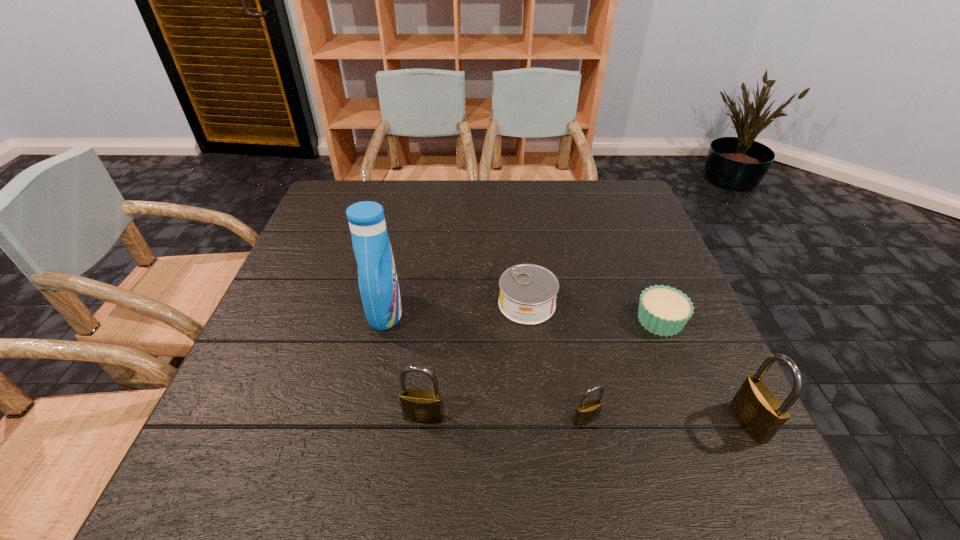
The height and width of the screenshot is (540, 960). Find the location of `the second shortest padlock`. the second shortest padlock is located at coordinates (423, 406).

The height and width of the screenshot is (540, 960). In order to click on the second object from left to right in this screenshot , I will do `click(423, 406)`.

The image size is (960, 540). What are the coordinates of `the third shortest object` in the screenshot? It's located at (586, 412).

The image size is (960, 540). I want to click on the shortest padlock, so click(x=586, y=412).

You are a GUI agent. You are given a task and a screenshot of the screen. Output one action in this format:
    pyautogui.click(x=<x>, y=<y>)
    Task: Click on the rightmost padlock
    The width and height of the screenshot is (960, 540).
    Given the screenshot: What is the action you would take?
    pyautogui.click(x=758, y=410)

Where is `can`? This screenshot has height=540, width=960. can is located at coordinates (528, 292).

Identify the location of cupcake. (663, 310).

The width and height of the screenshot is (960, 540). Identify the location of the leftmost object. (378, 283).

The image size is (960, 540). Identify the location of the tallest object. (378, 283).

At what (x,y) coordinates should I click in order to perform the action: click on free space located 0.180m on the back of the fourth shortest object. Please return your answer as a coordinate pair (x, y). This screenshot has height=540, width=960. Looking at the image, I should click on tap(433, 335).